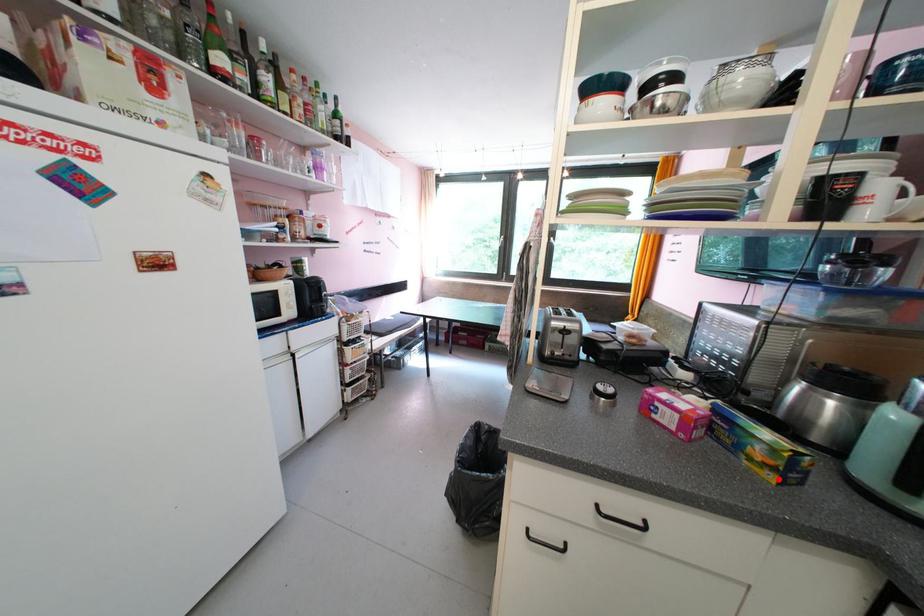
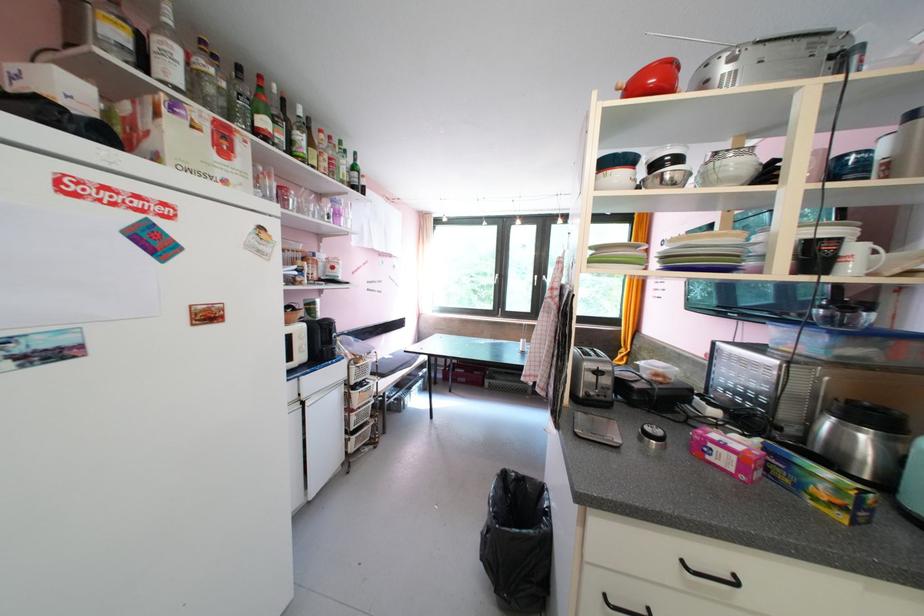
In the second image, find the point that corresponds to the highlighted location in the first image.

(849, 519)